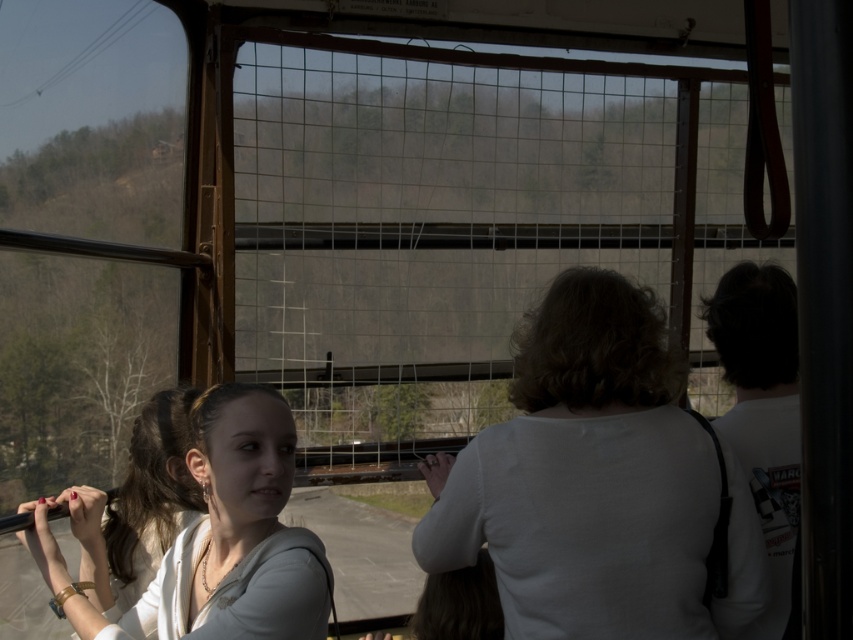
You are a photographer inside the vintage tram. You want to take a photo of the matte white shirt at left. Where should you aim your camera to capture it?

You should aim your camera at point (209, 538) to capture the matte white shirt at left.

You are a photographer inside the vintage tram. You want to take a photo of both the white matte shirt at center and the white matte shirt at right through the window. Since the window has a grid pattern, you need to ensure both shirts fit within a single grid section. The grid sections are 1 meter wide. Can both shirts fit side by side within one grid section?

The white matte shirt at center is wider than the white matte shirt at right. Since the grid sections are 1 meter wide, you need to check if their combined width is less than or equal to 1 meter. However, without knowing the exact widths of each shirt, it is impossible to determine if they can fit side by side within the 1 meter grid section.

You are standing at the entrance of the tram and want to hand a document to the passenger wearing the white matte shirt at center. Which direction should you move to reach them?

The white matte shirt at center is located at point 0.755 on the x axis and 0.699 on the y axis, so you should move towards the center of the tram to reach the passenger wearing the white matte shirt at center.